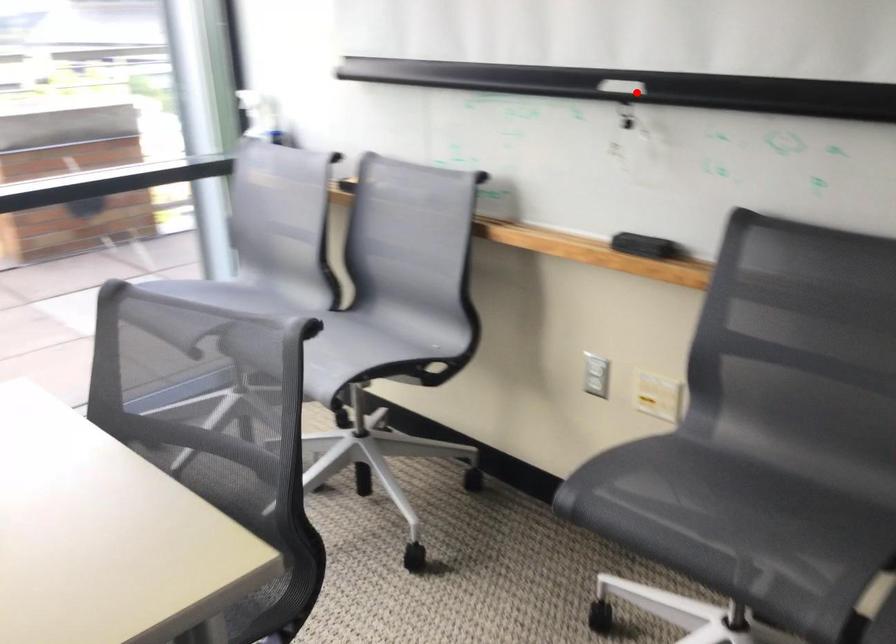
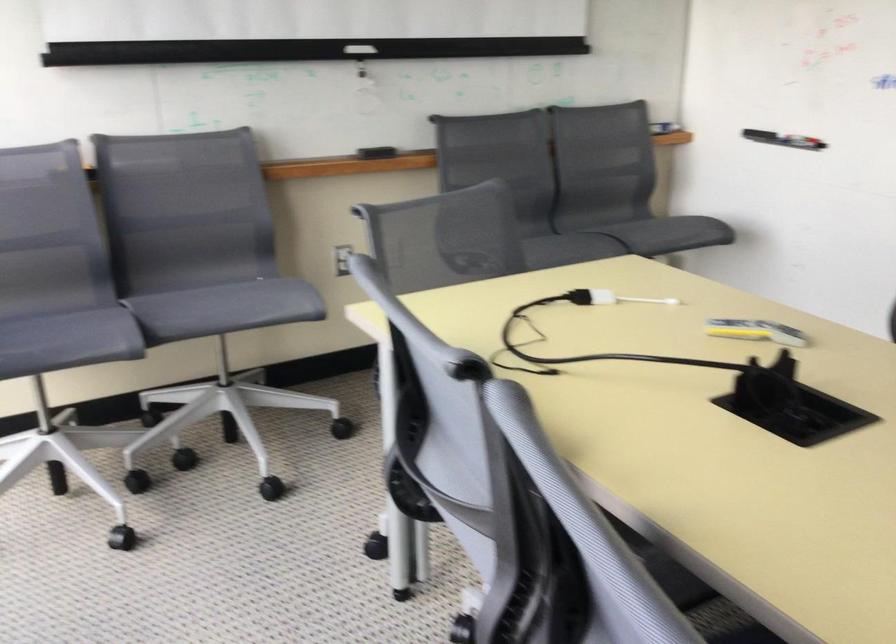
Find the pixel in the second image that matches the highlighted location in the first image.

(359, 49)